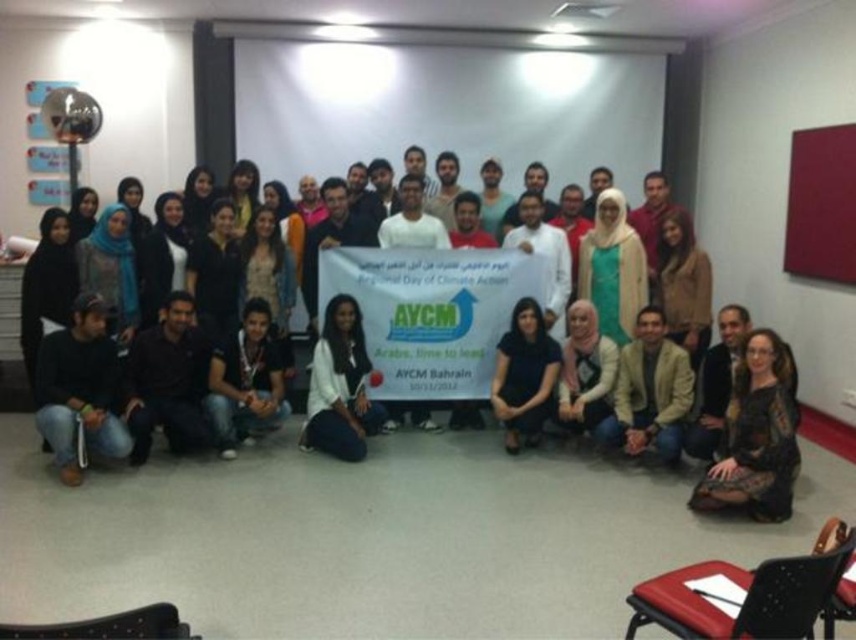
Question: Is black lace dress at lower right thinner than black fabric shirt at lower center?

Choices:
 (A) yes
 (B) no

Answer: (B)

Question: Does black lace dress at lower right appear over beige fabric jacket at lower center?

Choices:
 (A) no
 (B) yes

Answer: (A)

Question: Based on their relative distances, which object is nearer to the black fabric shirt at lower center?

Choices:
 (A) white matte shirt at center
 (B) beige fabric jacket at lower center
 (C) black lace dress at lower right

Answer: (B)

Question: Which point is farther to the camera?

Choices:
 (A) beige fabric jacket at lower center
 (B) white matte shirt at center
 (C) black lace dress at lower right

Answer: (B)

Question: Which object appears farthest from the camera in this image?

Choices:
 (A) beige fabric jacket at lower center
 (B) white matte shirt at center
 (C) black lace dress at lower right
 (D) black fabric shirt at lower center

Answer: (D)

Question: Is black lace dress at lower right to the left of beige fabric jacket at lower center from the viewer's perspective?

Choices:
 (A) no
 (B) yes

Answer: (A)